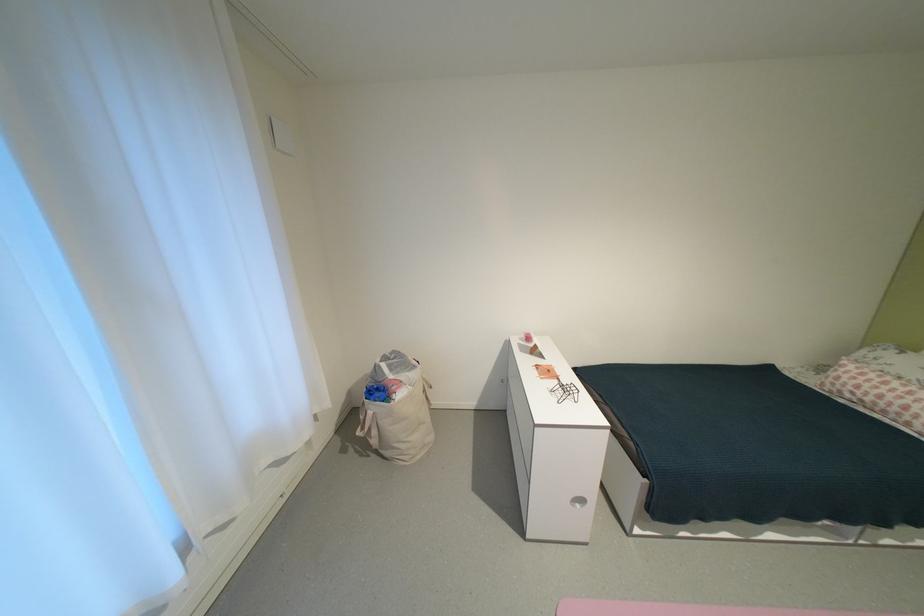
Find where to lift the laundry bag handle. Please return your answer as a coordinate pair (x, y).

(397, 410)